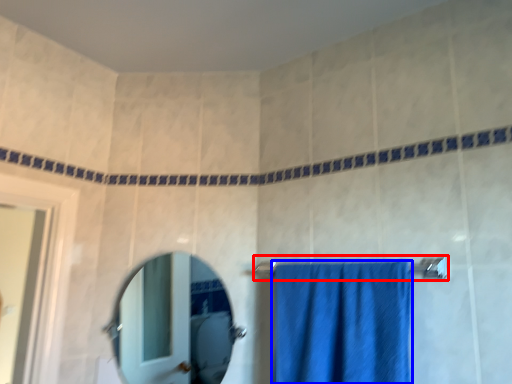
Question: Which object appears farthest to the camera in this image, towel bar (highlighted by a red box) or towel (highlighted by a blue box)?

Choices:
 (A) towel bar
 (B) towel

Answer: (A)